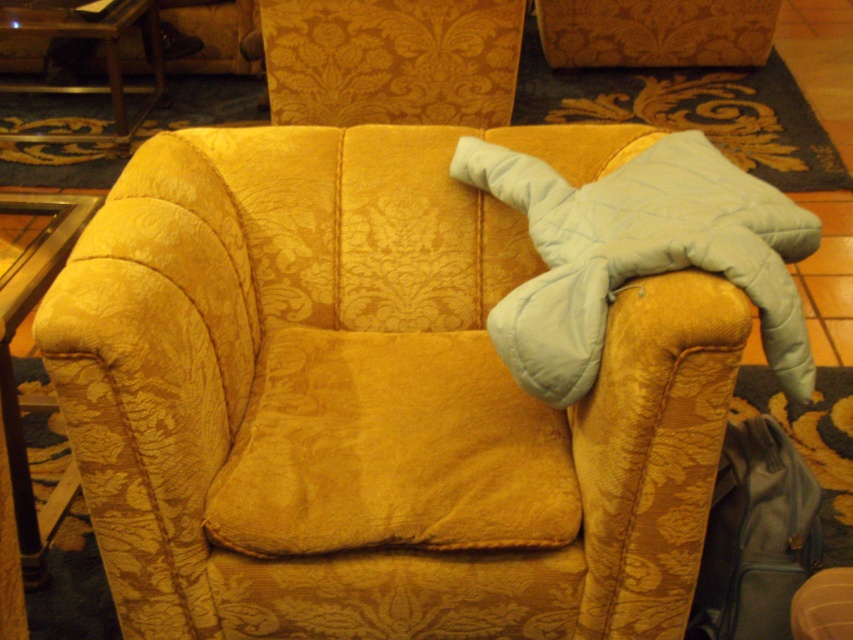
Is point (283, 522) in front of point (527, 211)?

Yes, point (283, 522) is in front of point (527, 211).

Between point (451, 381) and point (709, 161), which one is positioned in front?

Point (709, 161)

Locate an element on the screen. The height and width of the screenshot is (640, 853). velvet yellow pillow at center is located at coordinates (392, 451).

Can you confirm if light blue quilted blanket at upper right is positioned above leather suitcase at lower right?

Indeed, light blue quilted blanket at upper right is positioned over leather suitcase at lower right.

Between light blue quilted blanket at upper right and leather suitcase at lower right, which one is positioned higher?

Positioned higher is light blue quilted blanket at upper right.

Where is `light blue quilted blanket at upper right`? This screenshot has height=640, width=853. light blue quilted blanket at upper right is located at coordinates (637, 253).

This screenshot has height=640, width=853. I want to click on light blue quilted blanket at upper right, so click(x=637, y=253).

Can you confirm if velvet gold couch at center is positioned to the left of leather suitcase at lower right?

Correct, you'll find velvet gold couch at center to the left of leather suitcase at lower right.

In the scene shown: Can you confirm if velvet gold couch at center is bigger than leather suitcase at lower right?

Yes, velvet gold couch at center is bigger than leather suitcase at lower right.

Locate an element on the screen. The height and width of the screenshot is (640, 853). velvet gold couch at center is located at coordinates (368, 403).

At what (x,y) coordinates should I click in order to perform the action: click on velvet gold couch at center. Please return your answer as a coordinate pair (x, y). This screenshot has height=640, width=853. Looking at the image, I should click on (368, 403).